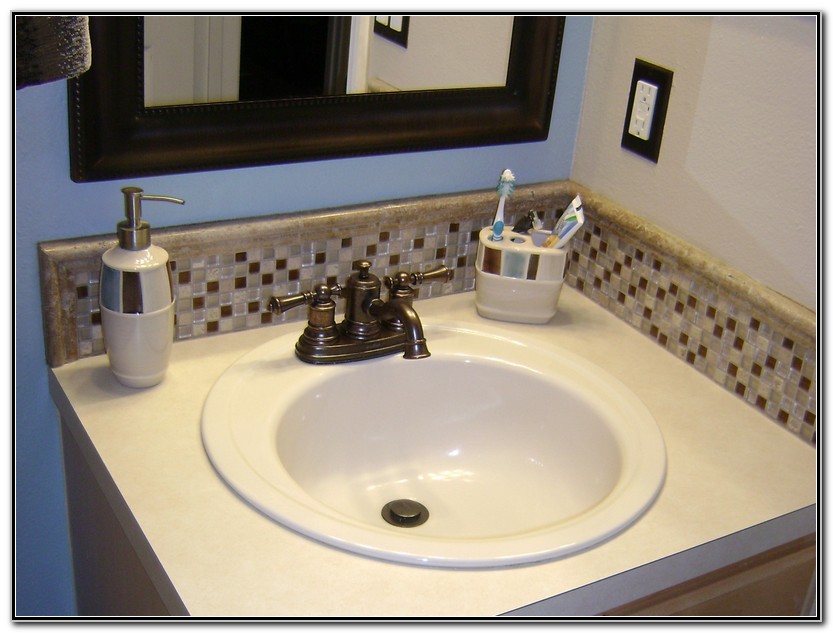
I want to click on grey towel, so click(38, 40).